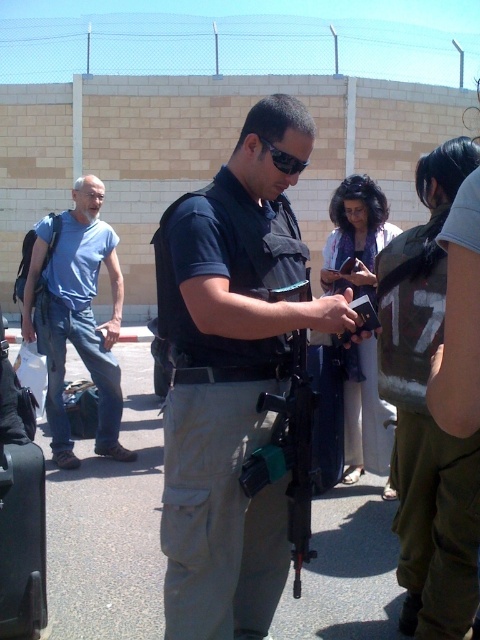
Does blue denim jeans at left appear under black plastic gun at center?

No, blue denim jeans at left is not below black plastic gun at center.

Is point (43, 298) farther from viewer compared to point (256, 486)?

Yes, point (43, 298) is farther from viewer.

Identify the location of blue denim jeans at left. The height and width of the screenshot is (640, 480). (76, 316).

Measure the distance from matte black vest at center to black plastic gun at center.

The distance of matte black vest at center from black plastic gun at center is 5.56 inches.

In order to click on matte black vest at center in this screenshot , I will do `click(230, 378)`.

Between point (62, 304) and point (301, 161), which one is positioned behind?

Point (62, 304)

Between blue denim jeans at left and black plastic sunglasses at center, which one is positioned lower?

blue denim jeans at left is below.

Is point (74, 467) in front of point (300, 172)?

No, (74, 467) is further to viewer.

Locate an element on the screen. This screenshot has height=640, width=480. blue denim jeans at left is located at coordinates (76, 316).